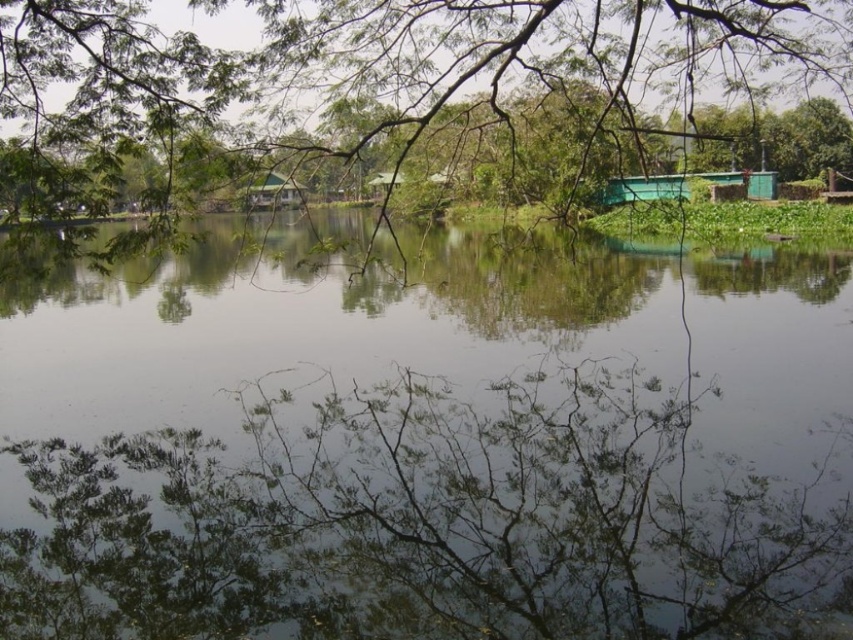
Is green reflective water at center behind green leafy tree at upper center?

Yes, it is.

This screenshot has width=853, height=640. I want to click on green reflective water at center, so click(x=428, y=445).

The height and width of the screenshot is (640, 853). Identify the location of green reflective water at center. point(428,445).